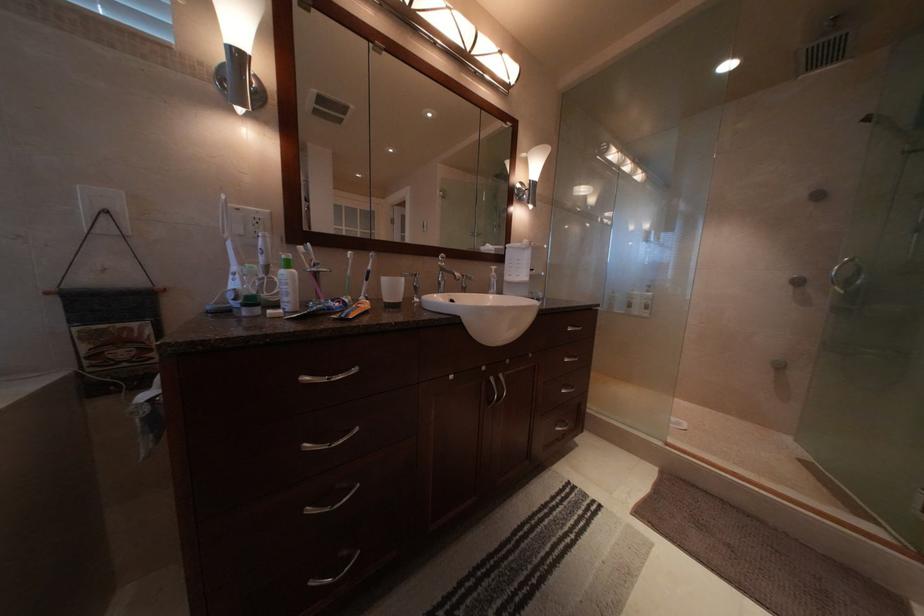
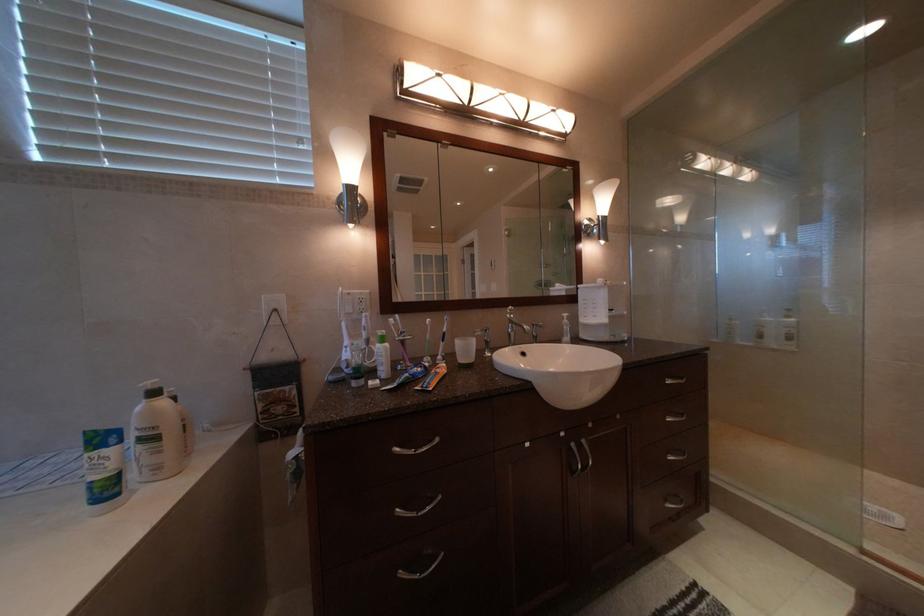
Question: The camera is either moving clockwise (left) or counter-clockwise (right) around the object. The first image is from the beginning of the video and the second image is from the end. Is the camera moving left or right when shooting the video?

Choices:
 (A) Left
 (B) Right

Answer: (B)